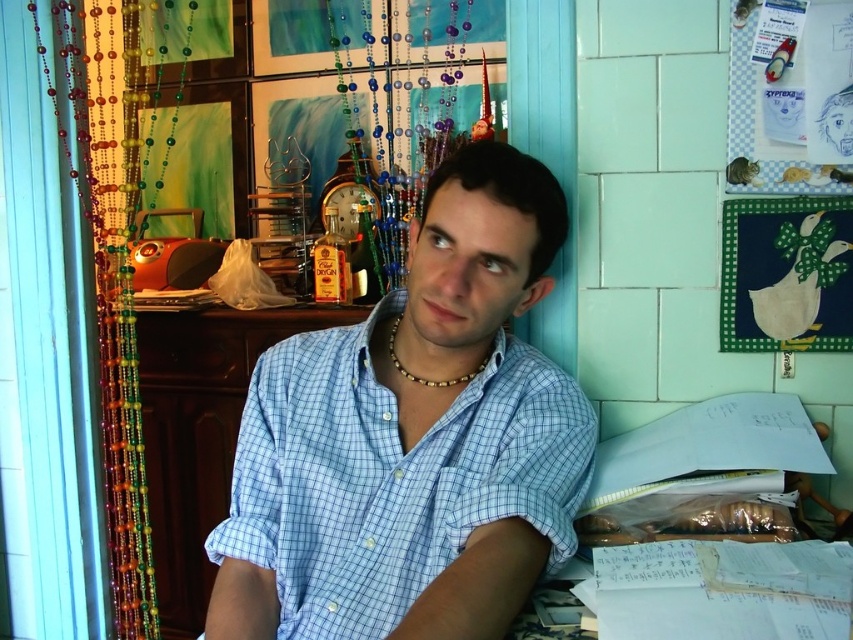
Question: Which of the following is the farthest from the observer?

Choices:
 (A) (202, 416)
 (B) (820, 333)
 (C) (486, 356)

Answer: (A)

Question: Which object appears farthest from the camera in this image?

Choices:
 (A) blue checkered shirt at center
 (B) beaded curtain at left
 (C) wooden at center

Answer: (C)

Question: From the image, what is the correct spatial relationship of beaded curtain at left in relation to gold metallic necklace at center?

Choices:
 (A) below
 (B) above

Answer: (B)

Question: Which object appears farthest from the camera in this image?

Choices:
 (A) gold metallic necklace at center
 (B) blue checkered shirt at center
 (C) green fabric quilt at upper right
 (D) wooden at center

Answer: (D)

Question: Can you confirm if wooden at center is smaller than green fabric quilt at upper right?

Choices:
 (A) yes
 (B) no

Answer: (B)

Question: Does blue checkered shirt at center appear on the left side of wooden at center?

Choices:
 (A) yes
 (B) no

Answer: (B)